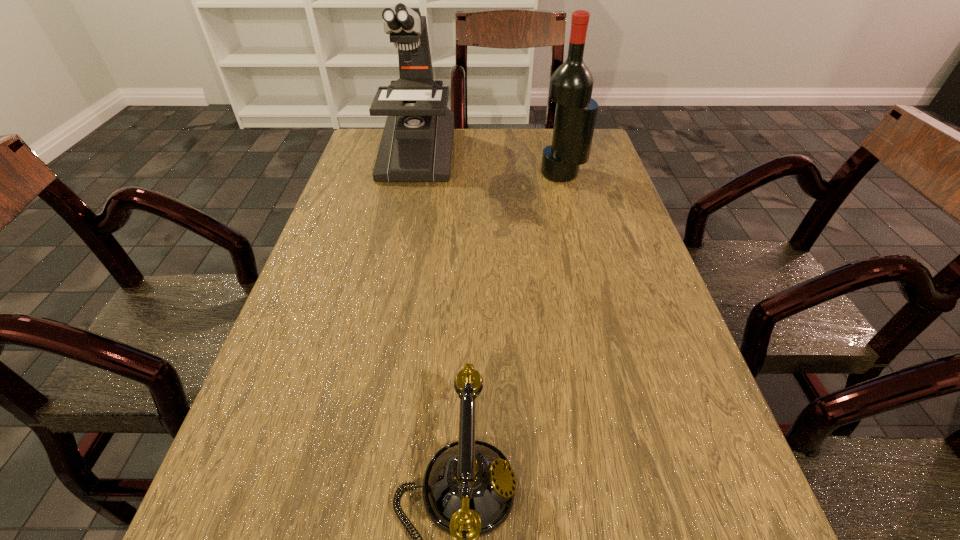
Locate an element on the screen. Image resolution: width=960 pixels, height=540 pixels. vacant space at the far edge is located at coordinates (455, 154).

The image size is (960, 540). Find the location of `free spot at the left edge of the desktop`. free spot at the left edge of the desktop is located at coordinates (298, 431).

Where is `blank space at the right edge of the desktop`? blank space at the right edge of the desktop is located at coordinates (564, 194).

In the image, there is a desktop. Where is `vacant region at the far left corner`? This screenshot has height=540, width=960. vacant region at the far left corner is located at coordinates (349, 166).

This screenshot has height=540, width=960. I want to click on empty space that is in between the microscope and the rightmost object, so click(490, 164).

Where is `free space between the microscope and the wine bottle`? This screenshot has height=540, width=960. free space between the microscope and the wine bottle is located at coordinates (490, 164).

Locate an element on the screen. The image size is (960, 540). free point between the microscope and the rightmost object is located at coordinates (490, 164).

Identify which object is the nearest to the microscope. Please provide its 2D coordinates. Your answer should be formatted as a tuple, i.e. [(x, y)], where the tuple contains the x and y coordinates of a point satisfying the conditions above.

[(571, 85)]

Choose which object is the second nearest neighbor to the wine bottle. Please provide its 2D coordinates. Your answer should be formatted as a tuple, i.e. [(x, y)], where the tuple contains the x and y coordinates of a point satisfying the conditions above.

[(468, 490)]

The image size is (960, 540). Identify the location of vacant point that satisfies the following two spatial constraints: 1. through the eyepieces of the rightmost object; 2. on the left side of the microscope. (412, 173).